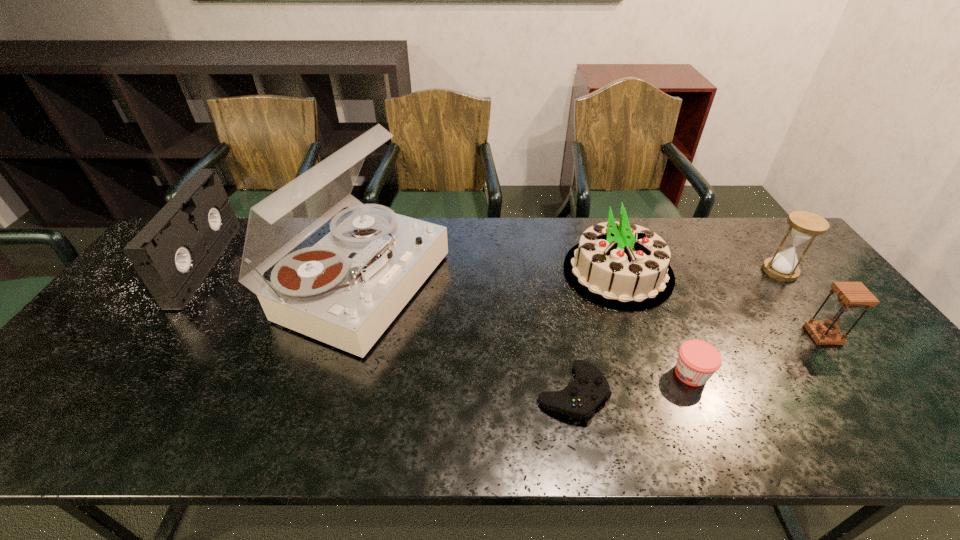
Locate an element on the screen. birthday cake located at the far edge is located at coordinates (619, 265).

Where is `hourglass located in the far edge section of the desktop`? The image size is (960, 540). hourglass located in the far edge section of the desktop is located at coordinates (804, 226).

Identify the location of object situated at the near edge. The height and width of the screenshot is (540, 960). (579, 399).

Locate an element on the screen. object that is at the left edge is located at coordinates (173, 254).

Find the location of a particular element. object that is positioned at the far left corner is located at coordinates (173, 254).

Image resolution: width=960 pixels, height=540 pixels. I want to click on object located at the far right corner, so click(x=804, y=226).

Locate an element on the screen. vacant region at the near edge of the desktop is located at coordinates (108, 427).

Locate an element on the screen. The width and height of the screenshot is (960, 540). free space at the left edge is located at coordinates (137, 348).

At what (x,y) coordinates should I click in order to perform the action: click on free spot between the leftmost object and the control. Please return your answer as a coordinate pair (x, y). This screenshot has width=960, height=540. Looking at the image, I should click on (389, 328).

Find the location of `vacant space in between the record player and the birthday cake`. vacant space in between the record player and the birthday cake is located at coordinates (489, 278).